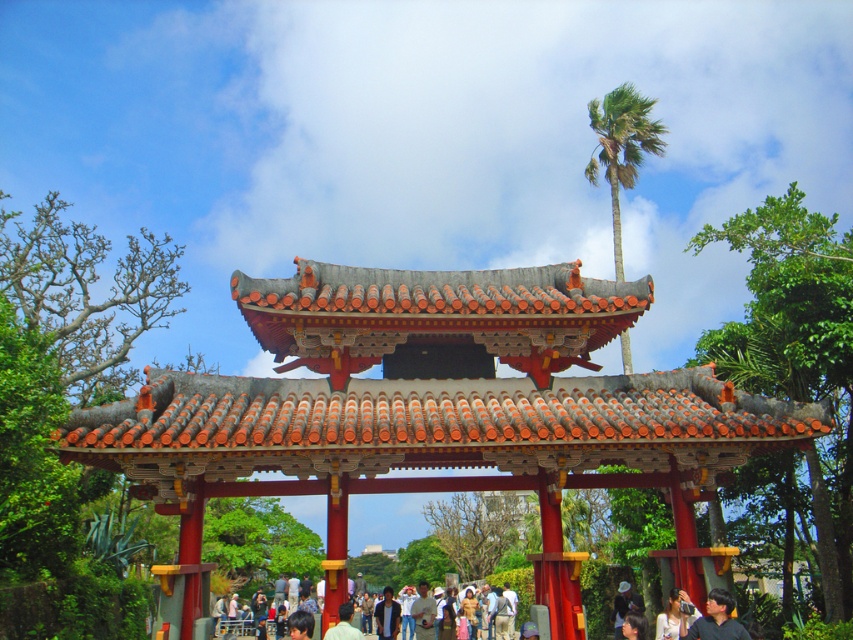
You are standing in front of a traditional East Asian gate and need to place a 20 feet long banner between the matte black shirt at lower right and the light brown fabric bag at lower center. Can the banner fit between them without overlapping either object?

The distance between the matte black shirt at lower right and the light brown fabric bag at lower center is 20.82 feet, so the 20 feet long banner can fit between them without overlapping either object since it is shorter than the available space.